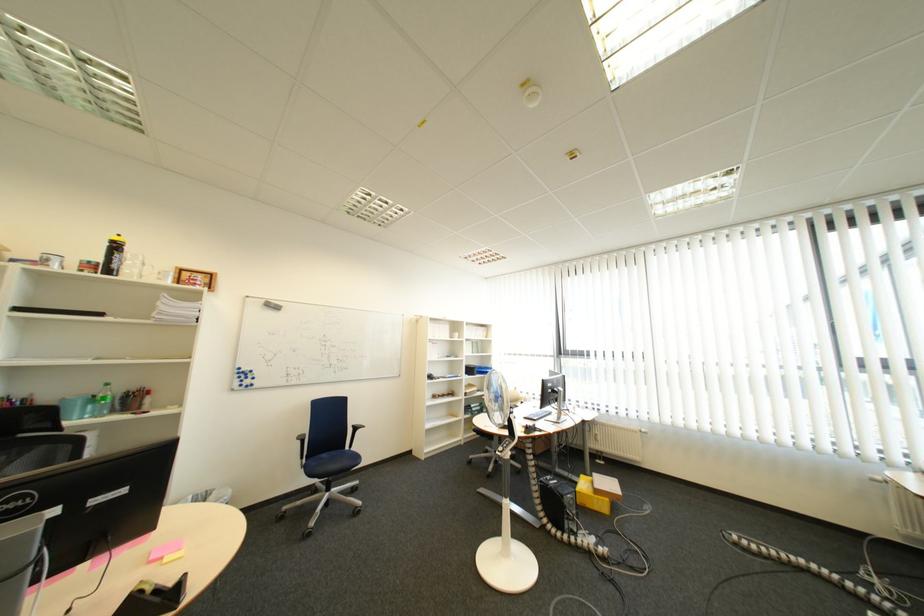
At what (x,y) coordinates should I click in order to perform the action: click on green plastic bottle. Please return your answer as a coordinate pair (x, y). Looking at the image, I should click on (103, 400).